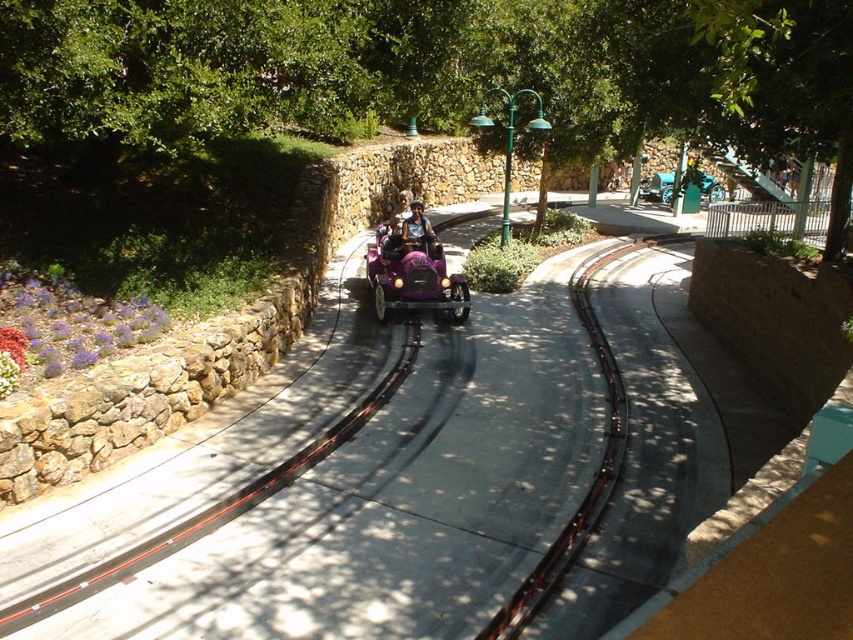
Is point (444, 278) positioned in front of point (422, 241)?

That is True.

Can you confirm if matte purple toy car at center is wider than metallic purple car at center?

Correct, the width of matte purple toy car at center exceeds that of metallic purple car at center.

Identify the location of matte purple toy car at center. Image resolution: width=853 pixels, height=640 pixels. (413, 276).

Where is `matte purple toy car at center`? matte purple toy car at center is located at coordinates (413, 276).

Is matte purple toy car at center above metallic teal car at center?

Incorrect, matte purple toy car at center is not positioned above metallic teal car at center.

Is point (399, 248) farther from viewer compared to point (706, 189)?

No.

Who is more forward, (392, 234) or (656, 188)?

Point (392, 234) is more forward.

In order to click on matte purple toy car at center in this screenshot , I will do `click(413, 276)`.

Can you confirm if metallic teal car at center is positioned below metallic purple car at center?

No.

Which is behind, point (666, 198) or point (433, 241)?

The point (666, 198) is more distant.

Which is in front, point (668, 193) or point (434, 241)?

Point (434, 241) is in front.

Identify the location of metallic teal car at center. The width and height of the screenshot is (853, 640). (657, 188).